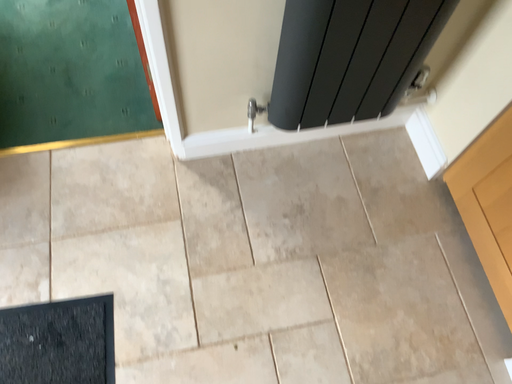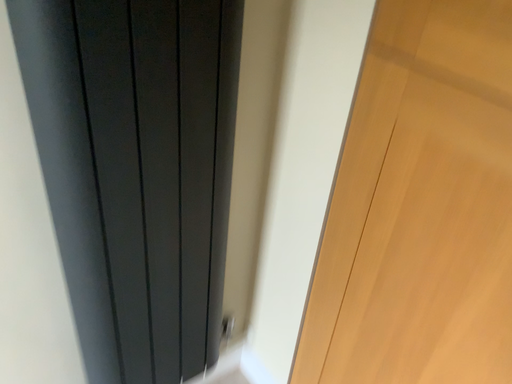
Question: How did the camera likely rotate when shooting the video?

Choices:
 (A) rotated downward
 (B) rotated upward

Answer: (B)